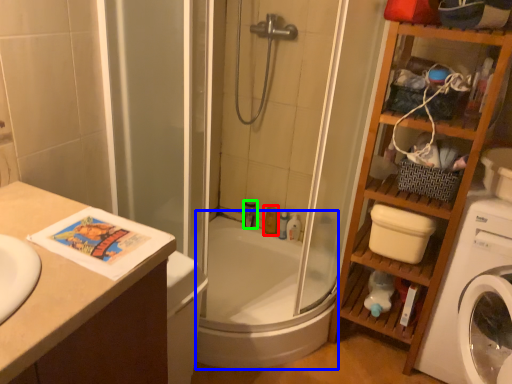
Question: Which object is the farthest from toiletry (highlighted by a red box)? Choose among these: bath (highlighted by a blue box) or toiletry (highlighted by a green box).

Choices:
 (A) bath
 (B) toiletry

Answer: (A)